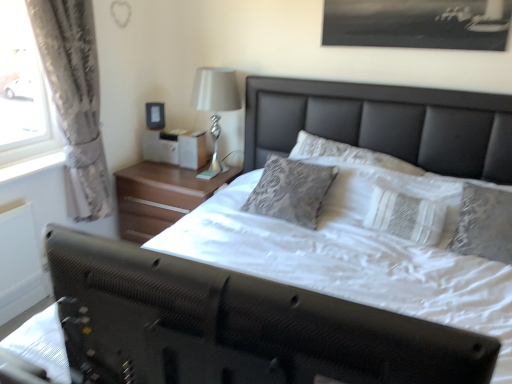
You are a GUI agent. You are given a task and a screenshot of the screen. Output one action in this format:
    pyautogui.click(x=<x>, y=<y>)
    Task: Click on the vacant space to the right of matte black picture frame at upper center
    The height and width of the screenshot is (384, 512).
    Given the screenshot: What is the action you would take?
    pyautogui.click(x=181, y=132)